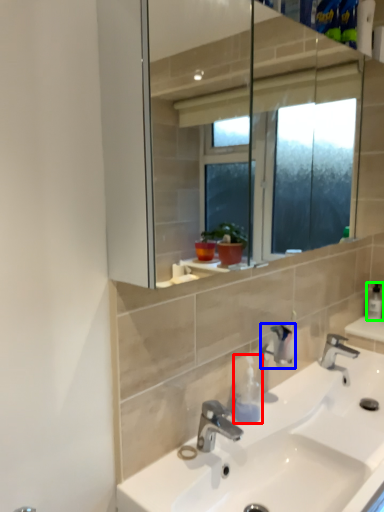
Question: Based on their relative distances, which object is nearer to soap dispenser (highlighted by a red box)? Choose from plumbing fixture (highlighted by a blue box) and soap dispenser (highlighted by a green box).

Choices:
 (A) plumbing fixture
 (B) soap dispenser

Answer: (A)